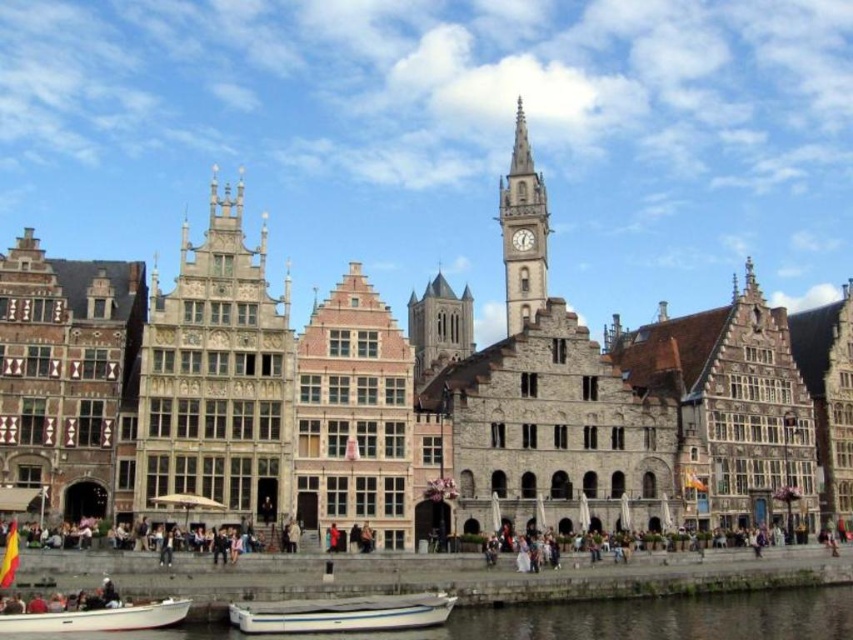
Question: Is stone carved tower at center wider than stone textured building at center?

Choices:
 (A) no
 (B) yes

Answer: (A)

Question: Does stone tower at center have a greater width compared to white matte boat at lower left?

Choices:
 (A) no
 (B) yes

Answer: (B)

Question: Which point is closer to the camera?

Choices:
 (A) (778, 624)
 (B) (251, 616)
 (C) (816, 499)
 (D) (451, 346)

Answer: (B)

Question: Which object is farther from the camera taking this photo?

Choices:
 (A) stone carved tower at center
 (B) white matte boat at lower left

Answer: (A)

Question: Which point is farther to the camera?

Choices:
 (A) (155, 625)
 (B) (316, 612)

Answer: (B)

Question: Is stone textured building at center closer to the viewer compared to white matte boat at lower left?

Choices:
 (A) no
 (B) yes

Answer: (A)